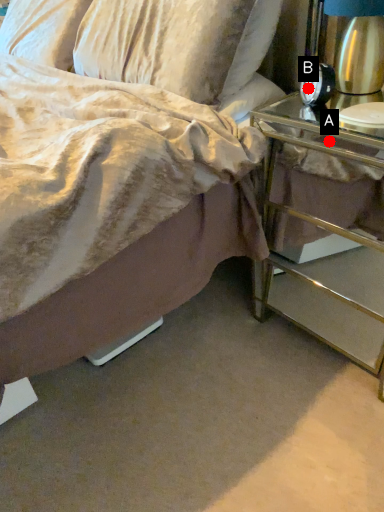
Question: Two points are circled on the image, labeled by A and B beside each circle. Which point is closer to the camera?

Choices:
 (A) A is closer
 (B) B is closer

Answer: (A)